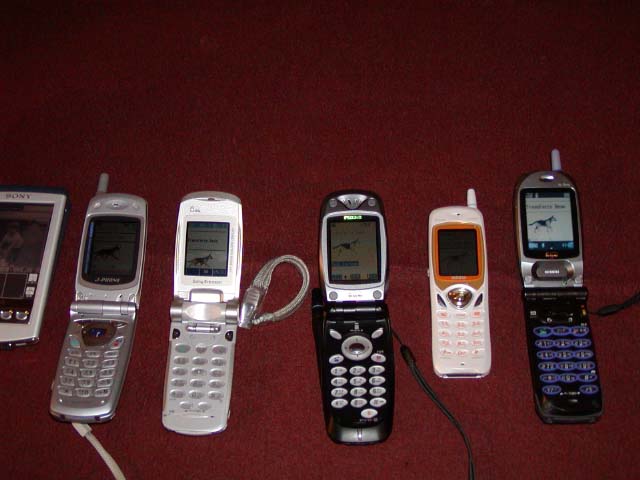
Locate an element on the screen. This screenshot has height=480, width=640. phones is located at coordinates (552, 291), (450, 319), (358, 320), (225, 289), (102, 281), (20, 257).